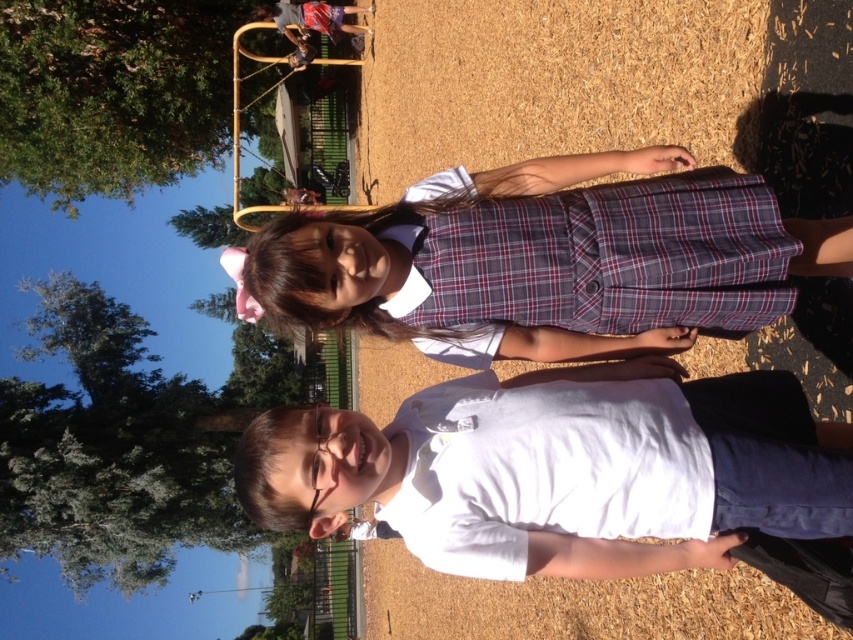
You are a photographer setting up for a group photo. You need to ensure that both the white matte shirt at center and the plaid fabric dress at center are clearly visible. Considering their sizes, which one might require more space in the frame to avoid being cropped out?

The white matte shirt at center has a larger size compared to the plaid fabric dress at center, so it might require more space in the frame to avoid being cropped out.

You are a photographer trying to capture a group photo of the two children in the scene. You need to arrange them so that the white matte shirt at center and the plaid fabric dress at center are visible. Based on their current positions, which child should be placed to the left to ensure both are in the frame?

The plaid fabric dress at center should be placed to the left because the white matte shirt at center is currently on the right side of the plaid fabric dress at center, so moving the plaid fabric dress at center to the left would position the white matte shirt at center to its right, ensuring both are visible in the frame.

You are taking a photo of the two children in the park. The first child is at point (323, 412) and the second child is at point (810, 250). Which child is closer to the camera?

Point (323, 412) is closer to the camera than point (810, 250), so the first child at point (323, 412) is closer to the camera.